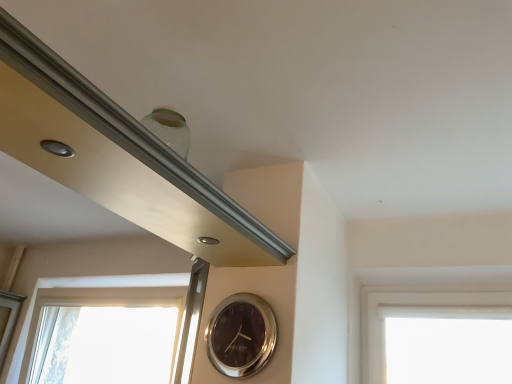
Question: From a real-world perspective, is transparent glass window at lower left positioned above or below shiny silver clock at center?

Choices:
 (A) above
 (B) below

Answer: (A)

Question: In terms of height, does transparent glass window at lower left look taller or shorter compared to shiny silver clock at center?

Choices:
 (A) short
 (B) tall

Answer: (B)

Question: Based on their sizes in the image, would you say transparent glass window at lower left is bigger or smaller than shiny silver clock at center?

Choices:
 (A) small
 (B) big

Answer: (B)

Question: Is shiny silver clock at center taller or shorter than transparent glass window at lower left?

Choices:
 (A) tall
 (B) short

Answer: (B)

Question: From the image's perspective, is shiny silver clock at center located above or below transparent glass window at lower left?

Choices:
 (A) below
 (B) above

Answer: (B)

Question: Would you say shiny silver clock at center is to the left or to the right of transparent glass window at lower left in the picture?

Choices:
 (A) right
 (B) left

Answer: (A)

Question: Is point (241, 336) positioned closer to the camera than point (68, 281)?

Choices:
 (A) closer
 (B) farther

Answer: (A)